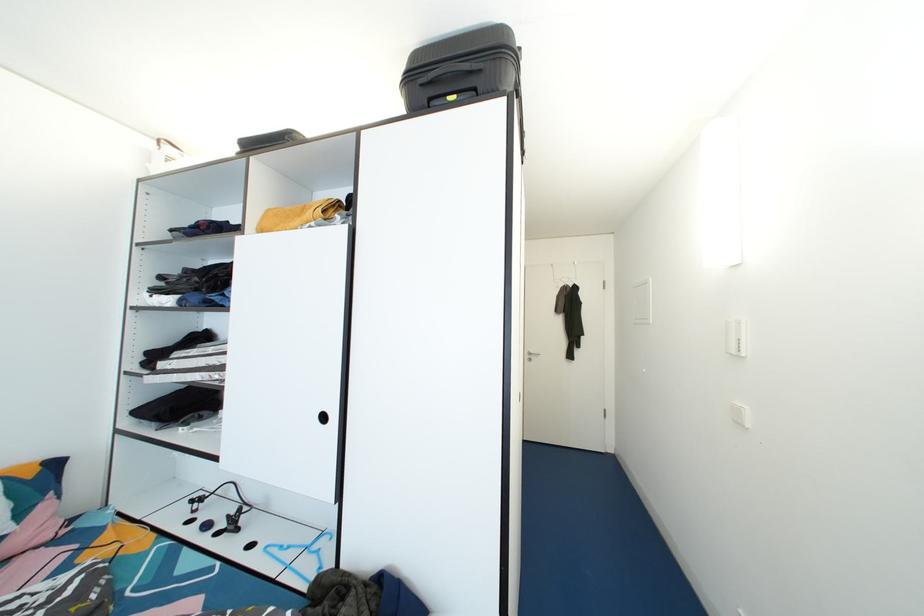
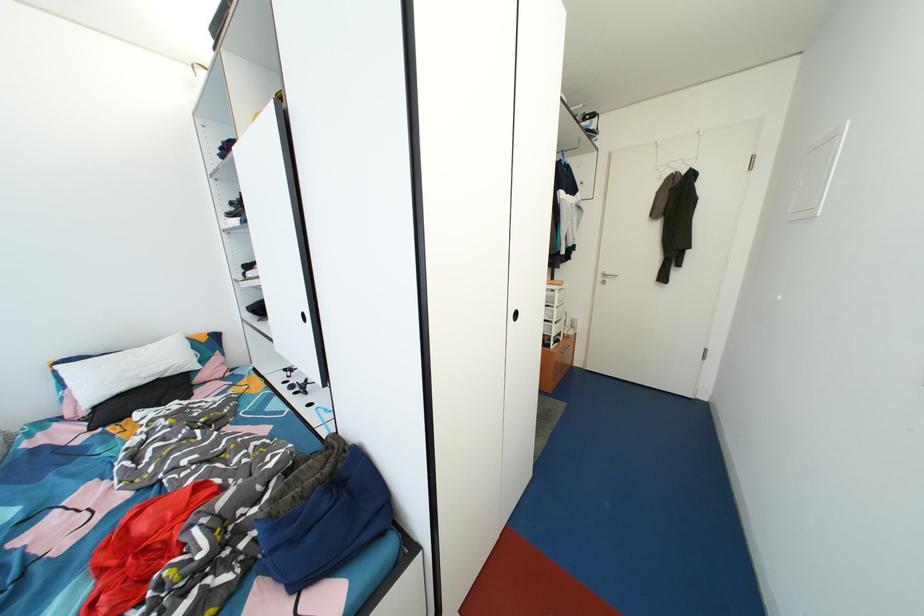
How did the camera likely rotate?

The rotation direction of the camera is left-down.